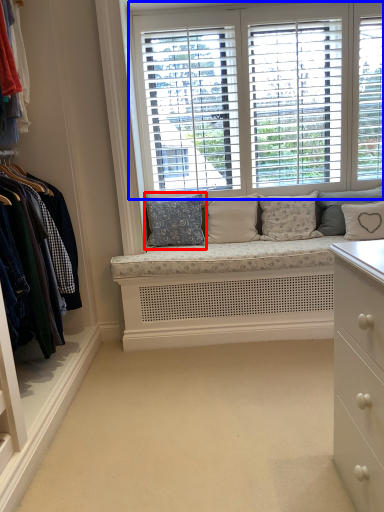
Question: Which point is closer to the camera, pillow (highlighted by a red box) or window (highlighted by a blue box)?

Choices:
 (A) pillow
 (B) window

Answer: (B)